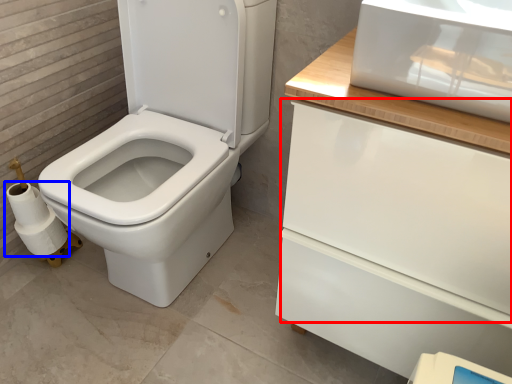
Question: Which point is further to the camera, drawer (highlighted by a red box) or toilet paper (highlighted by a blue box)?

Choices:
 (A) drawer
 (B) toilet paper

Answer: (B)